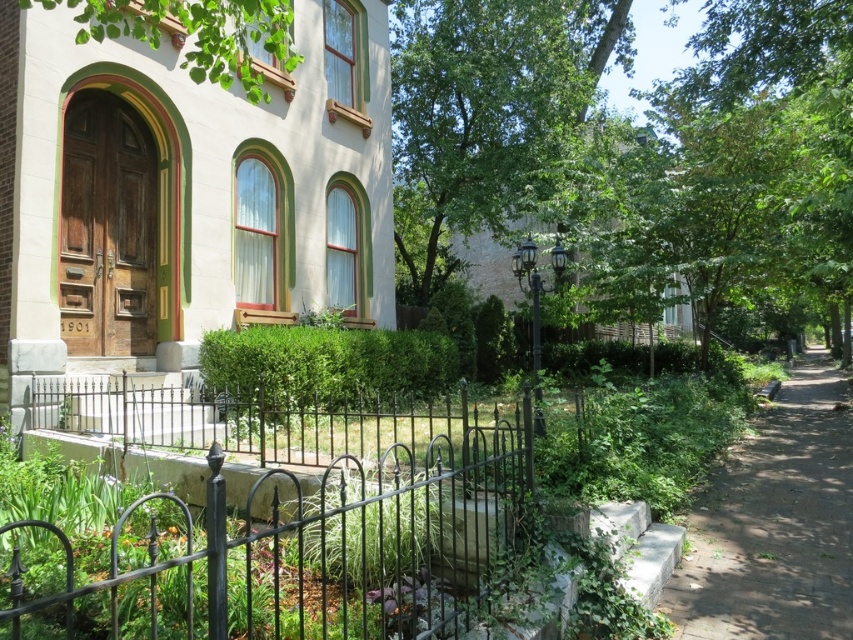
Question: Is the position of black wrought iron fence at lower center more distant than that of green leafy tree at upper left?

Choices:
 (A) yes
 (B) no

Answer: (B)

Question: Is black wrought iron fence at lower center above green leafy tree at upper left?

Choices:
 (A) no
 (B) yes

Answer: (A)

Question: Which object is farther from the camera taking this photo?

Choices:
 (A) black wrought iron fence at lower center
 (B) dirt path at right
 (C) green leafy tree at center
 (D) green leafy tree at upper left

Answer: (C)

Question: Considering the real-world distances, which object is farthest from the black wrought iron fence at lower center?

Choices:
 (A) dirt path at right
 (B) green leafy tree at center
 (C) green leafy tree at upper left

Answer: (B)

Question: Estimate the real-world distances between objects in this image. Which object is closer to the green leafy tree at center?

Choices:
 (A) black wrought iron fence at lower center
 (B) dirt path at right
 (C) green leafy tree at upper left

Answer: (B)

Question: Can you confirm if black wrought iron fence at lower center is wider than dirt path at right?

Choices:
 (A) yes
 (B) no

Answer: (B)